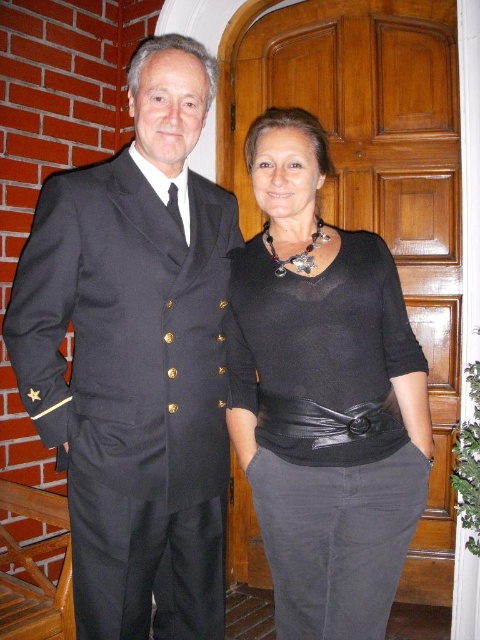
Question: Is black wool suit at left positioned before black matte sweater at center?

Choices:
 (A) no
 (B) yes

Answer: (B)

Question: Is black wool suit at left closer to camera compared to black matte sweater at center?

Choices:
 (A) yes
 (B) no

Answer: (A)

Question: Which point is closer to the camera?

Choices:
 (A) (284, 316)
 (B) (67, 474)

Answer: (A)

Question: Which point appears farthest from the camera in this image?

Choices:
 (A) (285, 445)
 (B) (176, 241)

Answer: (A)

Question: Does black wool suit at left have a greater width compared to black matte sweater at center?

Choices:
 (A) yes
 (B) no

Answer: (A)